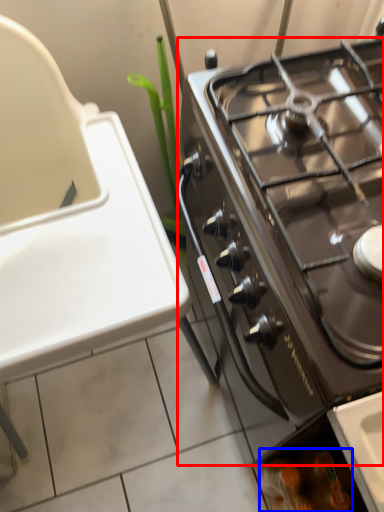
Question: Which point is closer to the camera, gas stove (highlighted by a red box) or food (highlighted by a blue box)?

Choices:
 (A) gas stove
 (B) food

Answer: (A)